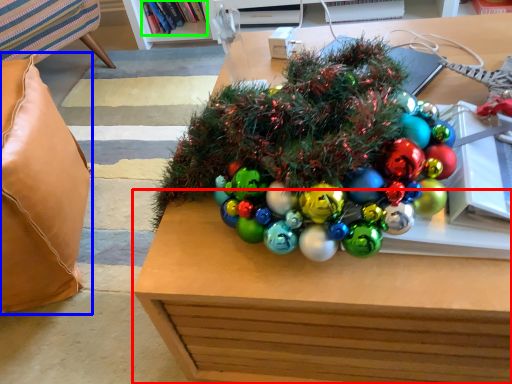
Question: Based on their relative distances, which object is nearer to table (highlighted by a red box)? Choose from pillow (highlighted by a blue box) and book (highlighted by a green box).

Choices:
 (A) pillow
 (B) book

Answer: (A)